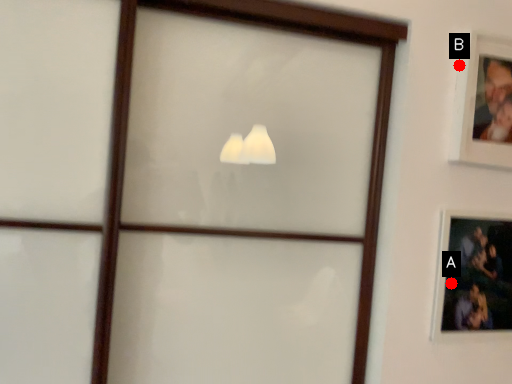
Question: Two points are circled on the image, labeled by A and B beside each circle. Which point is further to the camera?

Choices:
 (A) A is further
 (B) B is further

Answer: (A)